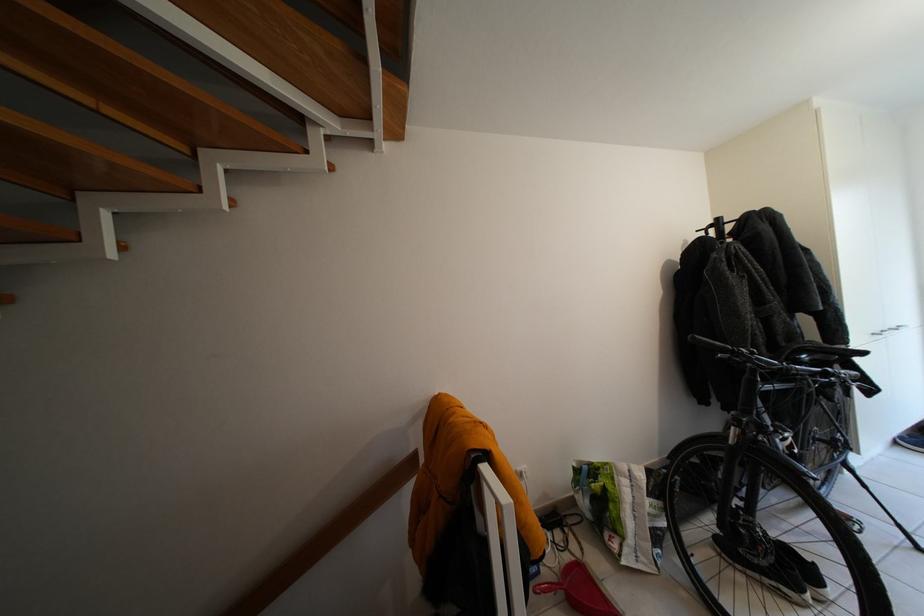
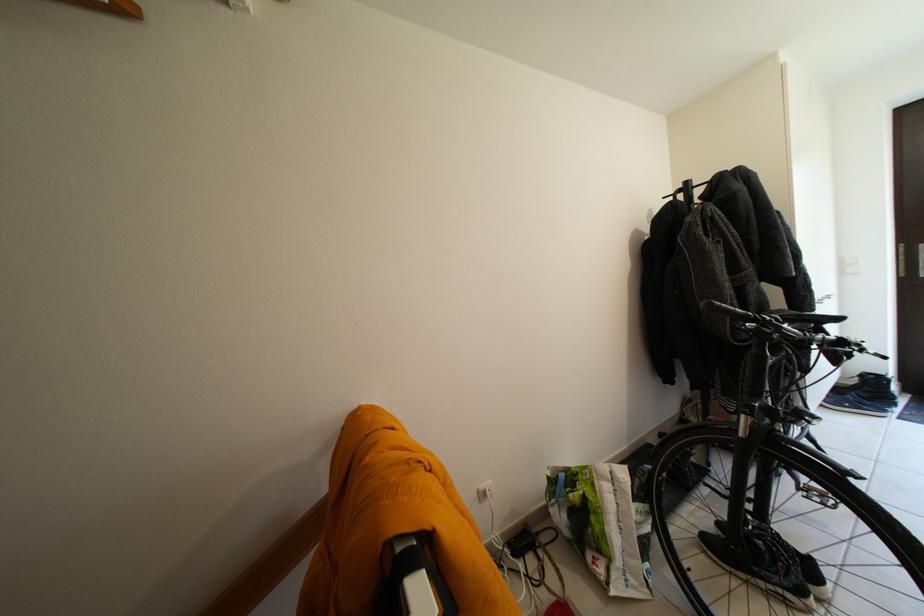
Find the pixel in the second image that matches the point at 657,515 in the first image.

(642, 522)